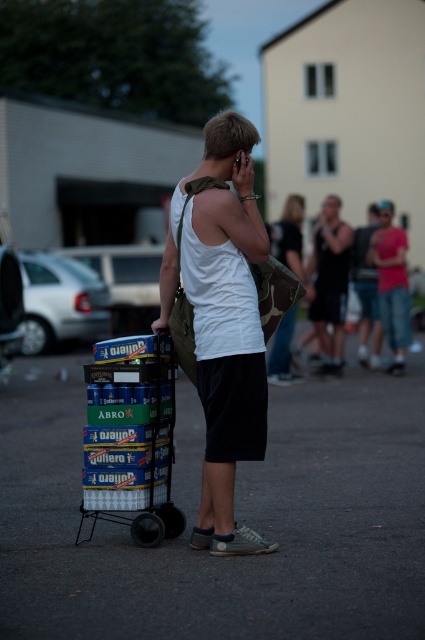
You are a fashion designer observing the man in the scene. You notice both the white matte tank top at center and the black tank top at center. Which one has a longer length when looking at them from the front?

The white matte tank top at center has a greater height compared to the black tank top at center, so the white matte tank top at center is longer in length when viewed from the front.